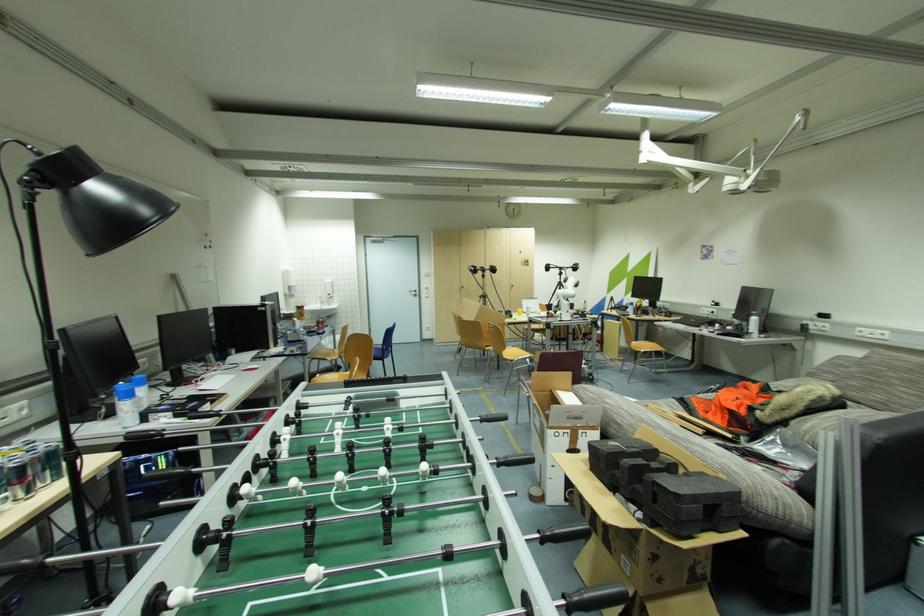
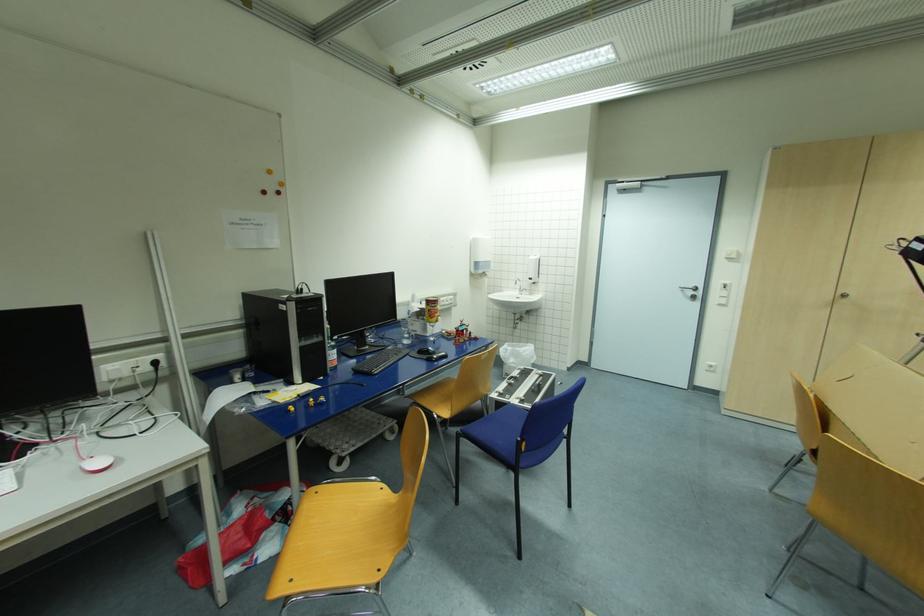
Find the pixel in the second image that matches point 304,309 in the first image.

(433, 302)